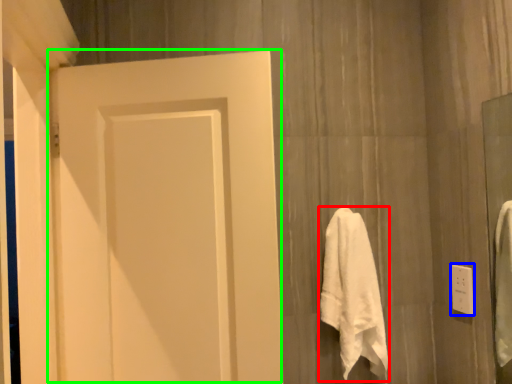
Question: Based on their relative distances, which object is farther from towel (highlighted by a red box)? Choose from electric outlet (highlighted by a blue box) and door (highlighted by a green box).

Choices:
 (A) electric outlet
 (B) door

Answer: (B)